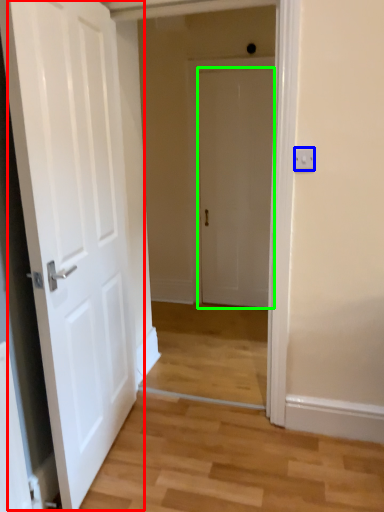
Question: Which is farther away from door (highlighted by a red box)? electric outlet (highlighted by a blue box) or door (highlighted by a green box)?

Choices:
 (A) electric outlet
 (B) door

Answer: (B)